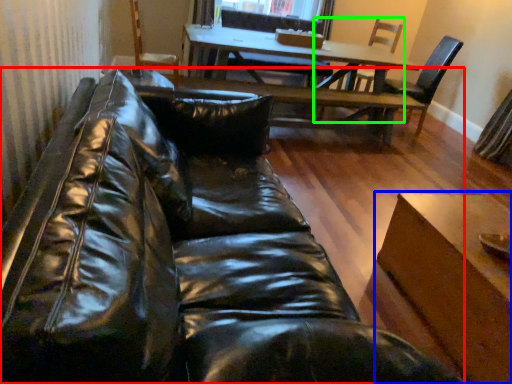
Question: Which object is the closest to the studio couch (highlighted by a red box)? Choose among these: table (highlighted by a blue box) or chair (highlighted by a green box).

Choices:
 (A) table
 (B) chair

Answer: (A)